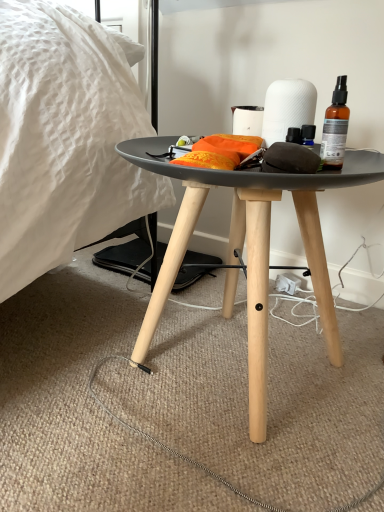
Where is `free region under black matte side table at center (from a real-world perspective)`? The width and height of the screenshot is (384, 512). free region under black matte side table at center (from a real-world perspective) is located at coordinates (231, 369).